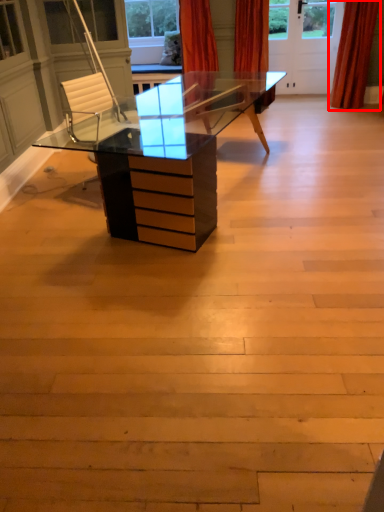
Question: Considering the relative positions of curtain (annotated by the red box) and curtain in the image provided, where is curtain (annotated by the red box) located with respect to the staircase?

Choices:
 (A) right
 (B) left

Answer: (A)